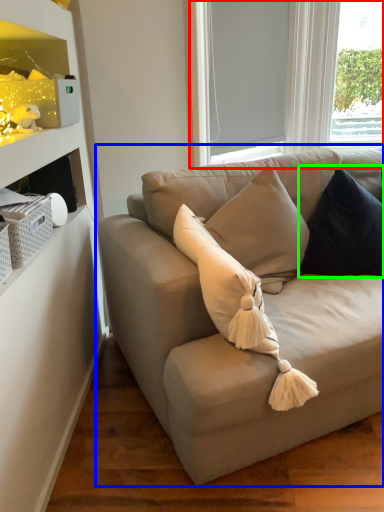
Question: Based on their relative distances, which object is nearer to bay window (highlighted by a red box)? Choose from studio couch (highlighted by a blue box) and pillow (highlighted by a green box).

Choices:
 (A) studio couch
 (B) pillow

Answer: (B)